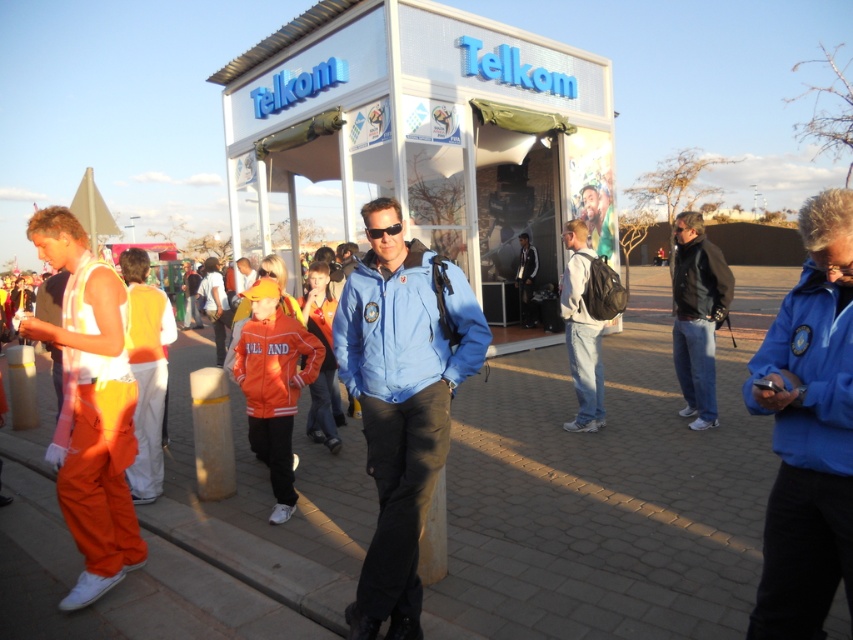
Question: Is brick pavement at center thinner than blue smooth jacket at right?

Choices:
 (A) yes
 (B) no

Answer: (B)

Question: Which point is farther from the camera taking this photo?

Choices:
 (A) (838, 332)
 (B) (366, 561)

Answer: (B)

Question: Among these points, which one is nearest to the camera?

Choices:
 (A) (701, 269)
 (B) (833, 371)

Answer: (B)

Question: Is orange fleece jacket at center wider than black leather jacket at right?

Choices:
 (A) no
 (B) yes

Answer: (B)

Question: Does brick pavement at center have a lesser width compared to black plastic goggles at center?

Choices:
 (A) no
 (B) yes

Answer: (A)

Question: Considering the real-world distances, which object is farthest from the blue smooth jacket at right?

Choices:
 (A) brick pavement at center
 (B) blue plastic booth at center
 (C) black leather jacket at right
 (D) black plastic goggles at center

Answer: (B)